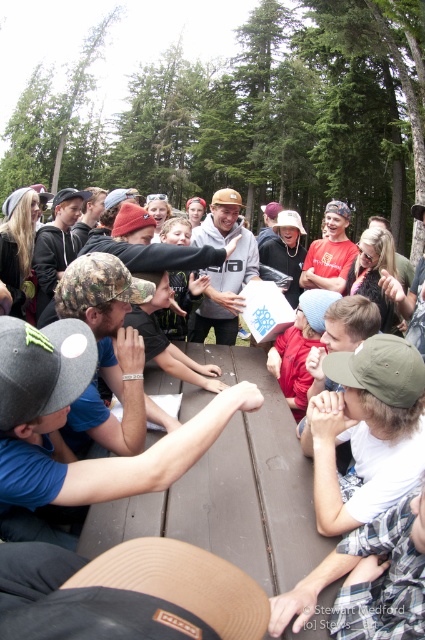
Can you confirm if blue fabric cap at center is positioned above matte gray hoodie at center?

No.

Is blue fabric cap at center to the left of matte gray hoodie at center from the viewer's perspective?

Yes, blue fabric cap at center is to the left of matte gray hoodie at center.

Between point (47, 440) and point (229, 320), which one is positioned in front?

Point (47, 440) is in front.

Where is `blue fabric cap at center`? The height and width of the screenshot is (640, 425). blue fabric cap at center is located at coordinates (65, 422).